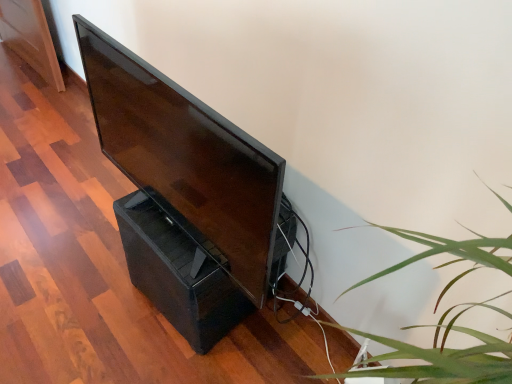
Where is `matte black screen at center`? The image size is (512, 384). matte black screen at center is located at coordinates (186, 157).

What do you see at coordinates (186, 157) in the screenshot? I see `matte black screen at center` at bounding box center [186, 157].

I want to click on matte black screen at center, so click(186, 157).